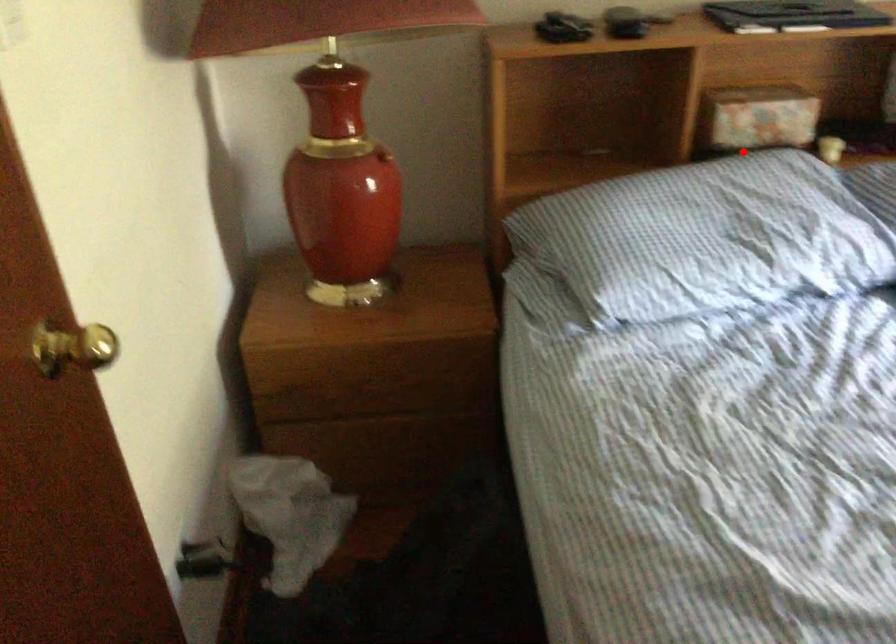
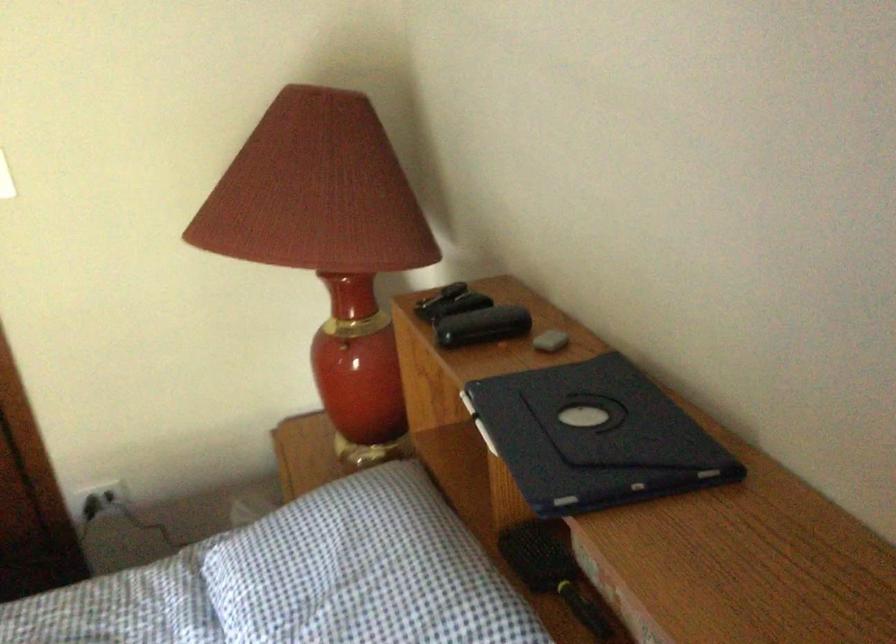
In the second image, find the point that corresponds to the highlighted location in the first image.

(552, 571)